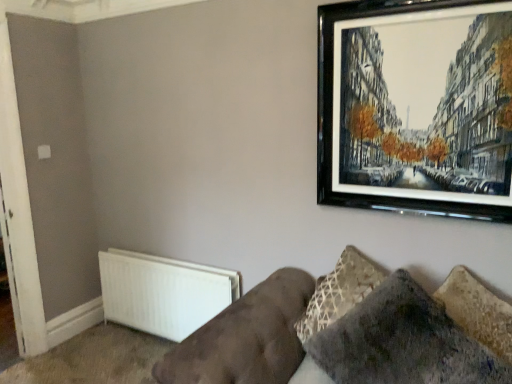
Question: Does velvet brown couch at lower right touch white matte door at left?

Choices:
 (A) yes
 (B) no

Answer: (B)

Question: Does velvet brown couch at lower right have a greater height compared to white matte door at left?

Choices:
 (A) yes
 (B) no

Answer: (B)

Question: Considering the relative sizes of velvet brown couch at lower right and white matte door at left in the image provided, is velvet brown couch at lower right shorter than white matte door at left?

Choices:
 (A) no
 (B) yes

Answer: (B)

Question: Is velvet brown couch at lower right aimed at white matte door at left?

Choices:
 (A) no
 (B) yes

Answer: (A)

Question: Can you confirm if velvet brown couch at lower right is smaller than white matte door at left?

Choices:
 (A) no
 (B) yes

Answer: (A)

Question: Is velvet brown couch at lower right bigger than white matte door at left?

Choices:
 (A) no
 (B) yes

Answer: (B)

Question: Does white matte radiator at lower left have a lesser width compared to black glossy picture frame at upper right?

Choices:
 (A) no
 (B) yes

Answer: (A)

Question: Considering the relative sizes of white matte radiator at lower left and black glossy picture frame at upper right in the image provided, is white matte radiator at lower left taller than black glossy picture frame at upper right?

Choices:
 (A) no
 (B) yes

Answer: (A)

Question: From a real-world perspective, does white matte radiator at lower left stand above black glossy picture frame at upper right?

Choices:
 (A) yes
 (B) no

Answer: (B)

Question: From the image's perspective, does white matte radiator at lower left appear lower than black glossy picture frame at upper right?

Choices:
 (A) yes
 (B) no

Answer: (A)

Question: Considering the relative sizes of white matte radiator at lower left and black glossy picture frame at upper right in the image provided, is white matte radiator at lower left bigger than black glossy picture frame at upper right?

Choices:
 (A) no
 (B) yes

Answer: (B)

Question: Can we say white matte radiator at lower left lies outside black glossy picture frame at upper right?

Choices:
 (A) yes
 (B) no

Answer: (A)

Question: Is velvet gray pillow at lower right oriented towards black glossy picture frame at upper right?

Choices:
 (A) yes
 (B) no

Answer: (B)